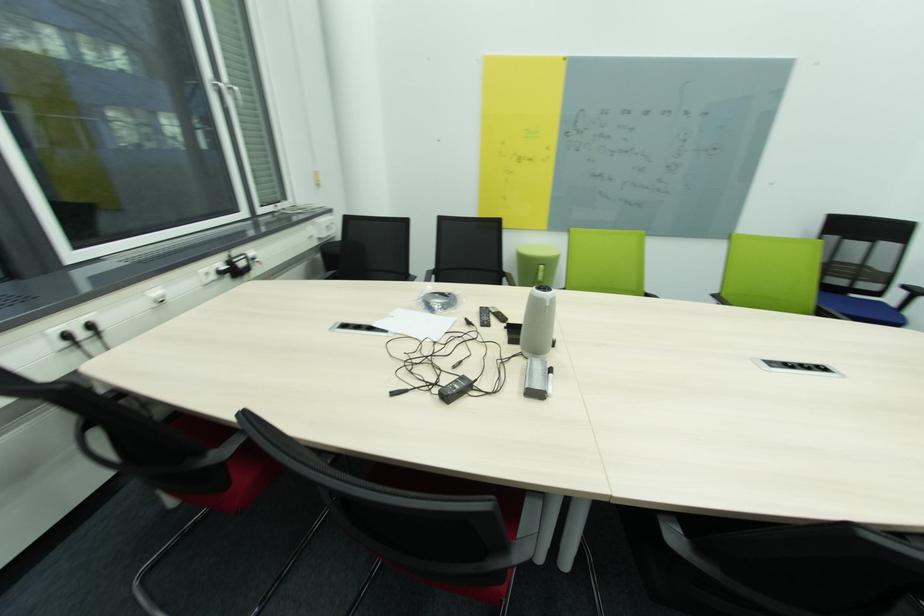
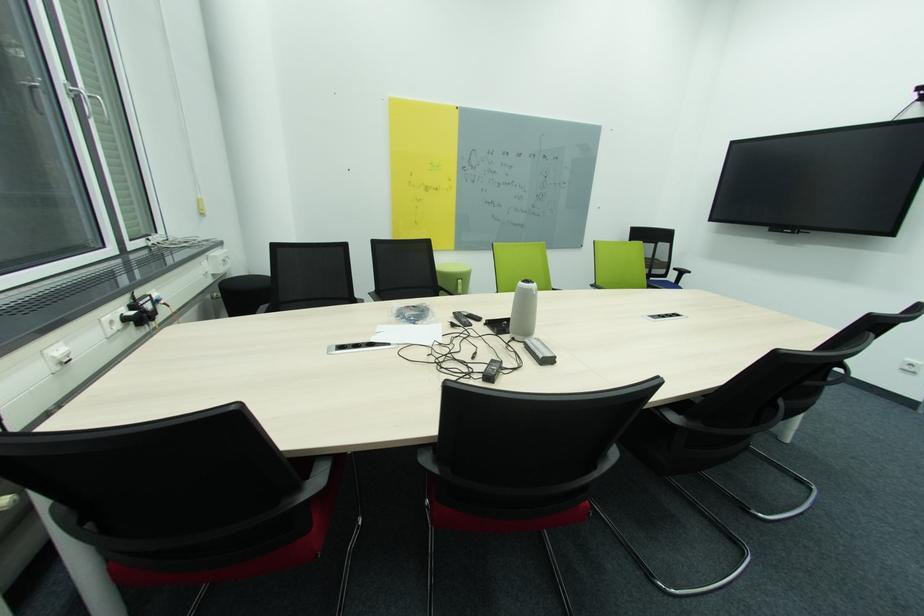
The point at (545,268) is marked in the first image. Where is the corresponding point in the second image?

(465, 282)